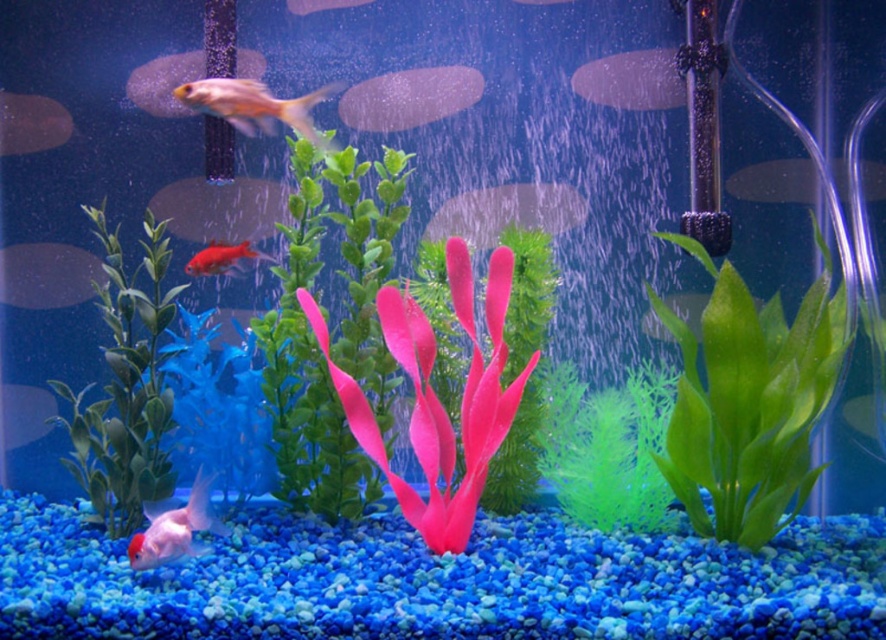
You are an aquatic plant enthusiast observing the aquarium. You notice the green matte plant at left and the green matte plant at center. Which one appears closer to you based on their positions in the aquarium?

The green matte plant at left appears closer because it is positioned in front of the green matte plant at center.

You are standing in front of the aquarium and want to know the distance to a specific point marked as point (797, 161). Can you determine how far it is from your current position?

The point (797, 161) is 3.45 meters away from the viewer.

You are a small fish swimming in the aquarium. You see two points in the tank, point [144,330] and point [644,388]. Which point is closer to you as you swim towards the front of the tank?

Point [144,330] is closer to you because it is further to the viewer than point [644,388].